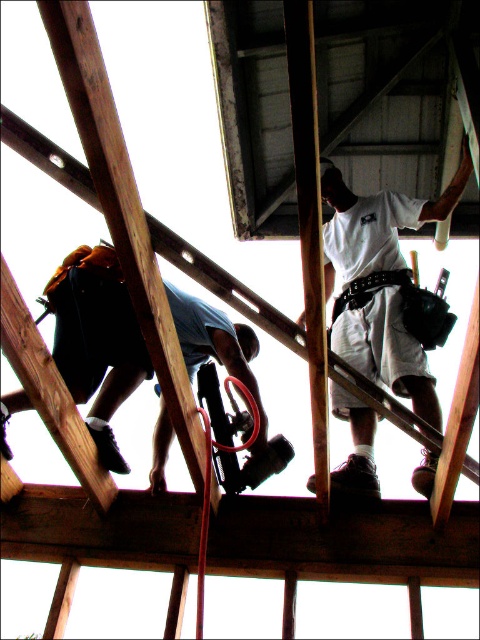
Question: Is blue denim jeans at lower left bigger than white fabric construction worker at upper center?

Choices:
 (A) yes
 (B) no

Answer: (B)

Question: Can you confirm if blue denim jeans at lower left is wider than white fabric construction worker at upper center?

Choices:
 (A) no
 (B) yes

Answer: (A)

Question: Which object appears closest to the camera in this image?

Choices:
 (A) white fabric construction worker at upper center
 (B) blue denim jeans at lower left

Answer: (B)

Question: In this image, where is blue denim jeans at lower left located relative to white fabric construction worker at upper center?

Choices:
 (A) above
 (B) below

Answer: (B)

Question: Which point is farther from the camera taking this photo?

Choices:
 (A) (437, 202)
 (B) (91, 332)

Answer: (A)